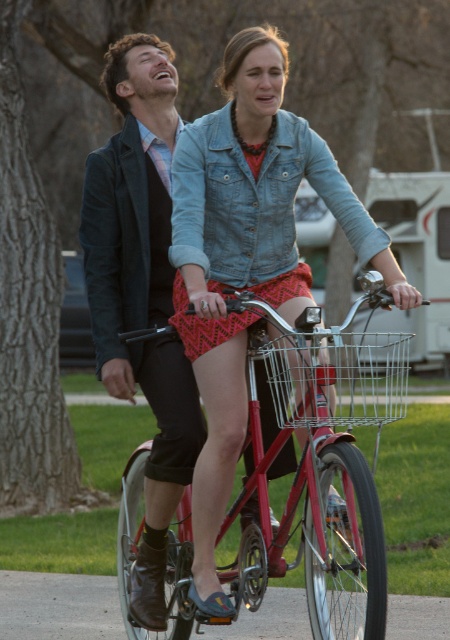
Question: Can you confirm if metallic red bicycle at center is wider than wire mesh basket at center?

Choices:
 (A) yes
 (B) no

Answer: (A)

Question: Among these objects, which one is farthest from the camera?

Choices:
 (A) denim jacket at center
 (B) velvet black jacket at left
 (C) metallic red bicycle at center
 (D) wire mesh basket at center

Answer: (B)

Question: Observing the image, what is the correct spatial positioning of denim jacket at center in reference to wire mesh basket at center?

Choices:
 (A) above
 (B) below

Answer: (A)

Question: Does metallic red bicycle at center lie behind denim jacket at center?

Choices:
 (A) yes
 (B) no

Answer: (B)

Question: Which point is closer to the camera?

Choices:
 (A) (387, 380)
 (B) (327, 147)
 (C) (124, 225)
 (D) (313, 477)

Answer: (A)

Question: Estimate the real-world distances between objects in this image. Which object is closer to the metallic red bicycle at center?

Choices:
 (A) velvet black jacket at left
 (B) denim jacket at center

Answer: (B)